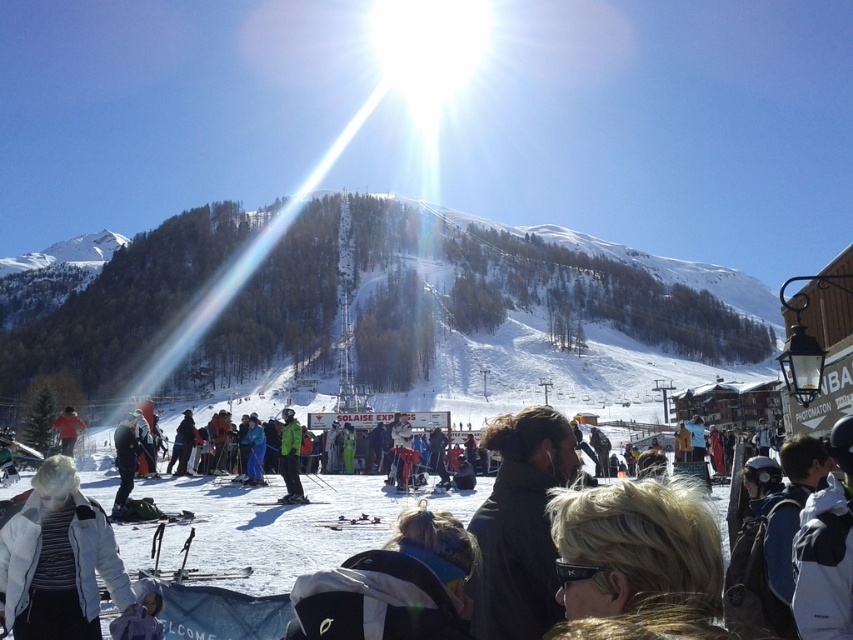
Can you confirm if white snowboarders at center is wider than green matte jacket at center?

Yes.

Between point (650, 548) and point (299, 456), which one is positioned in front?

Point (650, 548) is in front.

Find the location of `white snowboarders at center`. white snowboarders at center is located at coordinates (619, 547).

Between point (57, 556) and point (181, 580), which one is positioned in front?

Point (57, 556) is more forward.

Who is positioned more to the right, white fleece jacket at lower left or black matte ski at lower center?

From the viewer's perspective, black matte ski at lower center appears more on the right side.

Between point (61, 502) and point (242, 577), which one is positioned behind?

The point (242, 577) is behind.

Identify the location of white fleece jacket at lower left. point(57,560).

Who is shorter, white fleece jacket at lower left or black matte ski at center?

black matte ski at center is shorter.

Can you confirm if white fleece jacket at lower left is bigger than black matte ski at center?

Correct, white fleece jacket at lower left is larger in size than black matte ski at center.

The image size is (853, 640). What do you see at coordinates (57, 560) in the screenshot?
I see `white fleece jacket at lower left` at bounding box center [57, 560].

I want to click on white fleece jacket at lower left, so click(x=57, y=560).